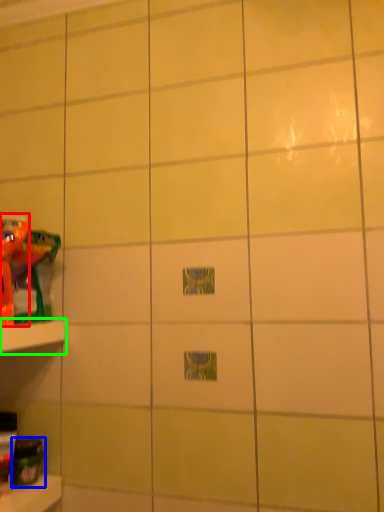
Question: Estimate the real-world distances between objects in this image. Which object is closer to toy (highlighted by a red box), toy (highlighted by a blue box) or shelf (highlighted by a green box)?

Choices:
 (A) toy
 (B) shelf

Answer: (B)